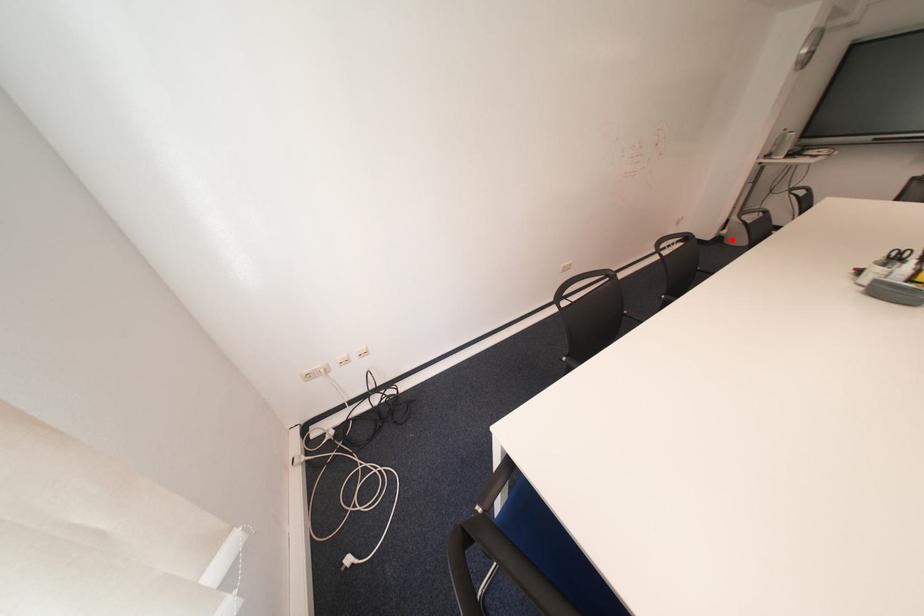
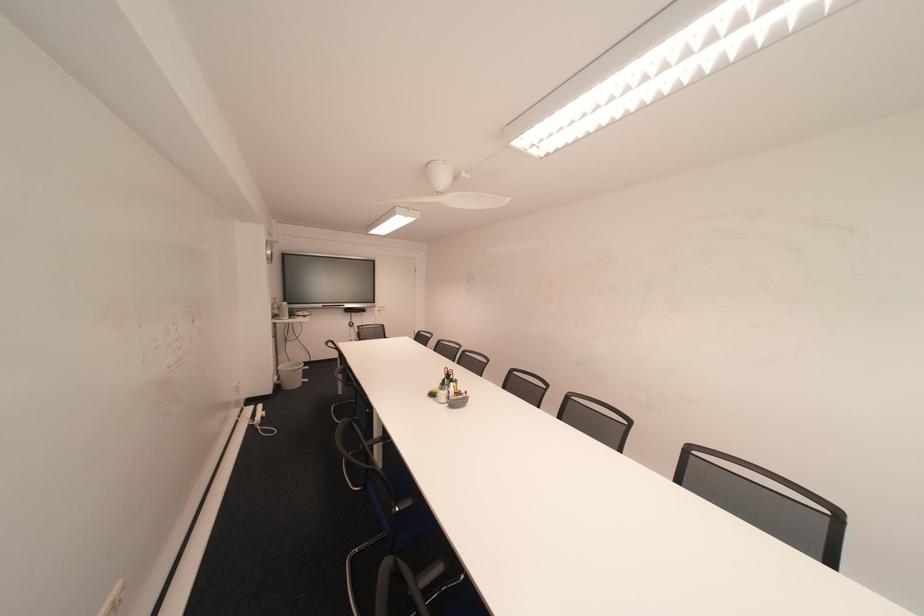
Locate, in the second image, the point that corresponds to the highlighted location in the first image.

(288, 387)